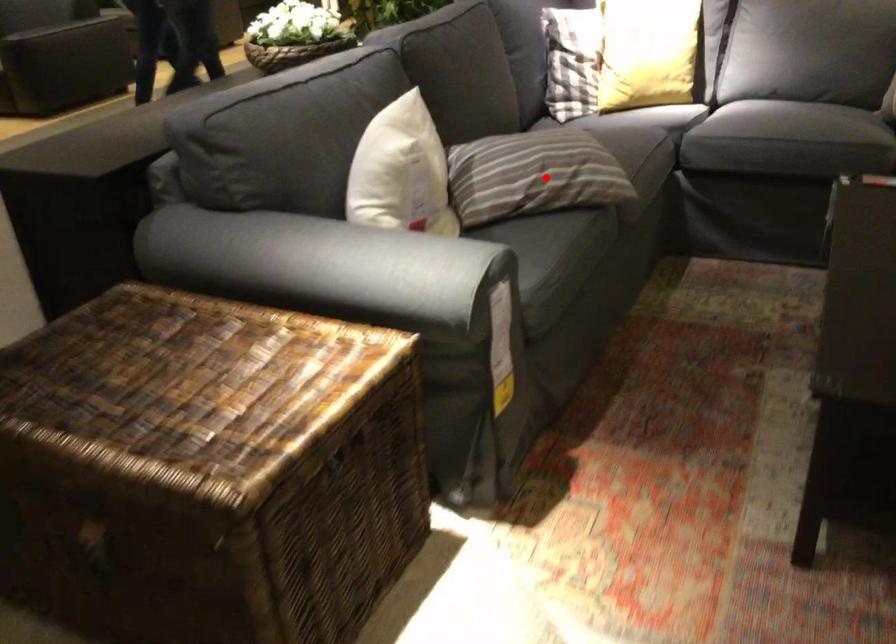
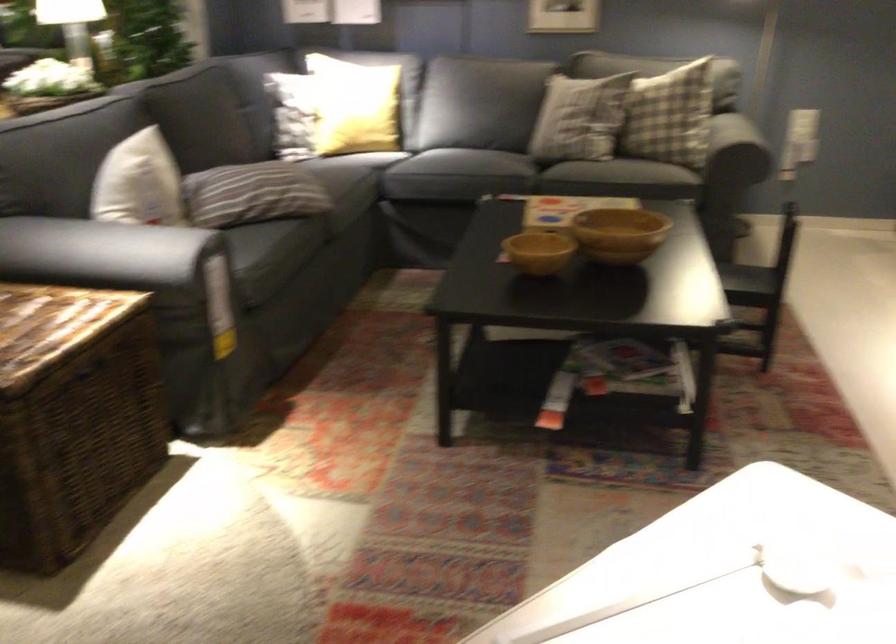
Question: I am providing you with two images of the same scene from different viewpoints. A red point is shown in image1. For the corresponding object point in image2, is it positioned nearer or farther from the camera?

Choices:
 (A) Nearer
 (B) Farther

Answer: (B)